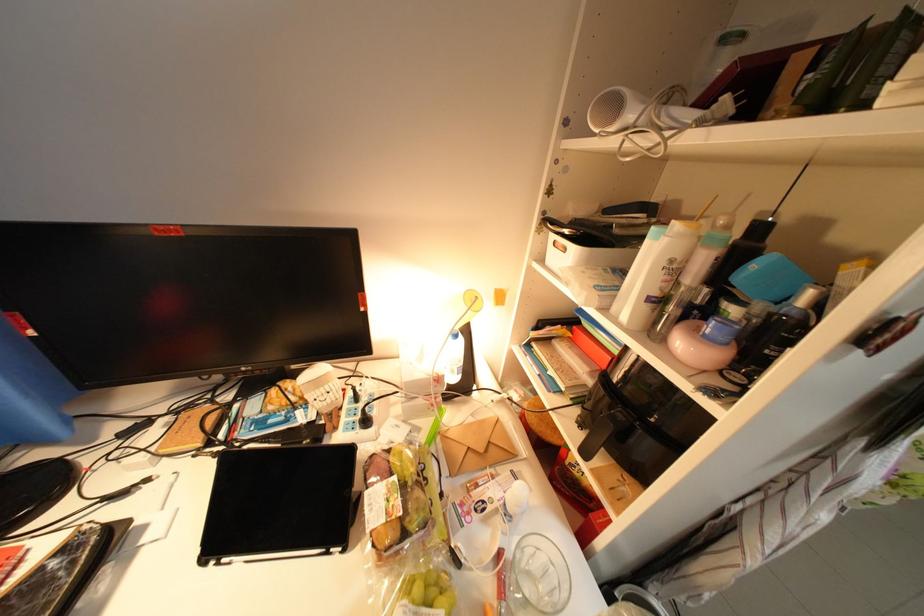
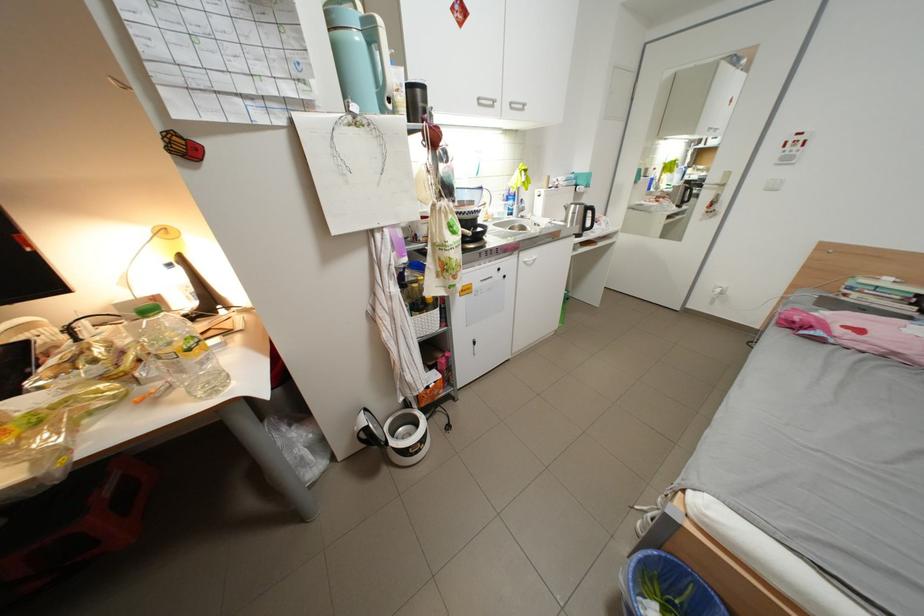
In a continuous first-person perspective shot, in which direction is the camera moving?

The cameraman walked toward right, backward.